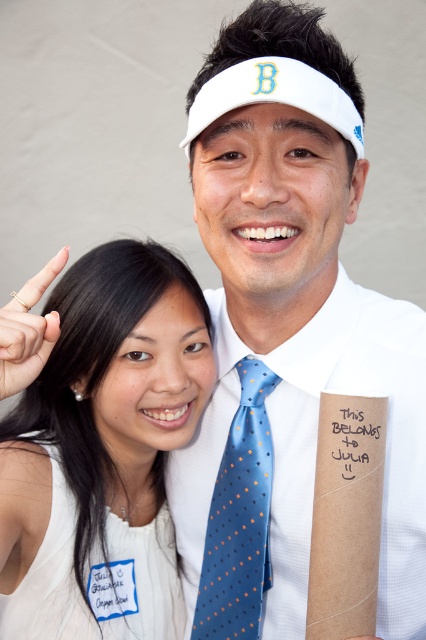
You are standing in front of the image and want to know the distance between the camera and the point labeled as point (222, 577). Can you tell me what it is?

The point labeled as point (222, 577) is 1.07 meters away from the camera.

You are standing 1.7 meters tall and want to reach the point at coordinates point (58, 316). Can you reach it without any assistance?

The point (58, 316) is 89.66 centimeters away from the viewer. Since the viewer is 1.7 meters tall, they can easily reach it without assistance as the distance is within their arm length.

You are a photographer trying to capture a closeup of the gold metallic ring at upper left while ensuring the white fabric dress at lower left does not block the view. Is this possible given their positions?

The white fabric dress at lower left is further to the viewer than the gold metallic ring at upper left, so the dress will block the view of the ring.